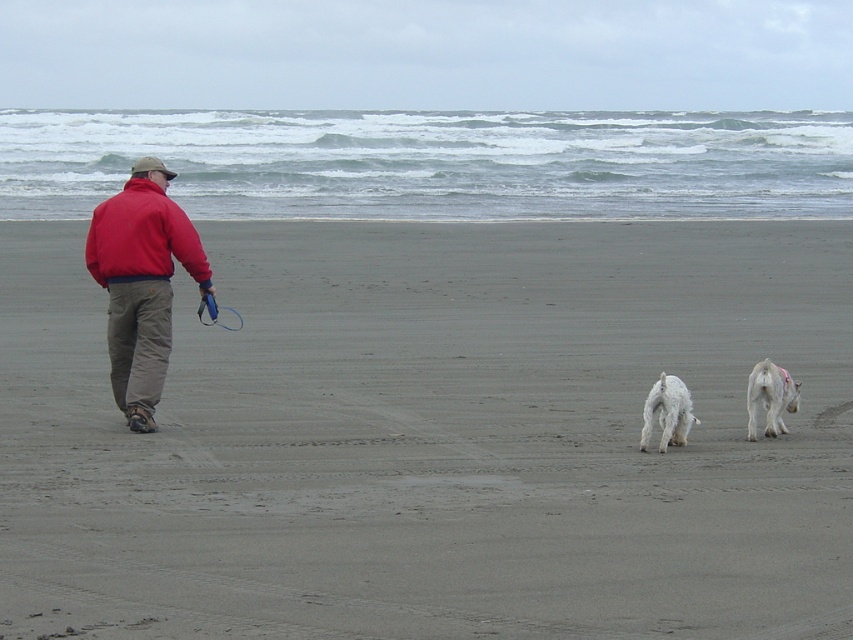
You are standing at the point marked as point (144, 384) on the beach. You want to throw a ball to your friend who is 10 meters away from you. Is your friend within the range to catch the ball?

The distance between you and your friend is 10 meters, which is within the typical throwing range, so yes, your friend can catch the ball.

You are standing at the location of the camera and want to throw a ball to the person wearing the red fleece jacket at left. If your throwing range is 10 meters, can you reach them?

The red fleece jacket at left and the camera are 11.37 meters apart. Since your throwing range is only 10 meters, you cannot reach them with a single throw.

You are standing at the beach and see the red fleece jacket at left and the white fluffy dog at center. Which object is positioned more to the left side of the scene?

The red fleece jacket at left is positioned more to the left side of the scene than the white fluffy dog at center.